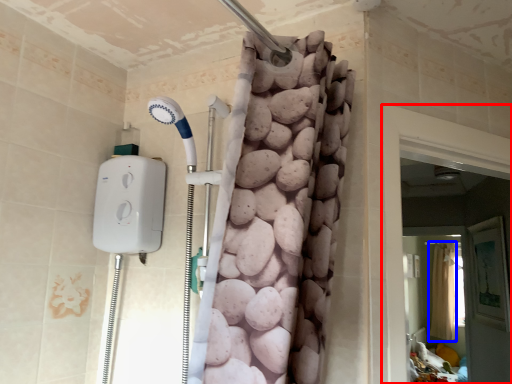
Question: Which point is closer to the camera, screen door (highlighted by a red box) or shower curtain (highlighted by a blue box)?

Choices:
 (A) screen door
 (B) shower curtain

Answer: (A)